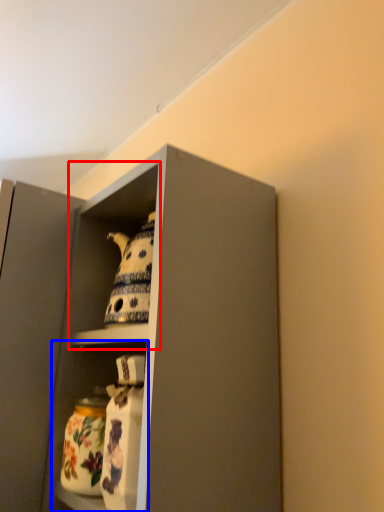
Question: Which object is further to the camera taking this photo, cabinet (highlighted by a red box) or shelf (highlighted by a blue box)?

Choices:
 (A) cabinet
 (B) shelf

Answer: (B)